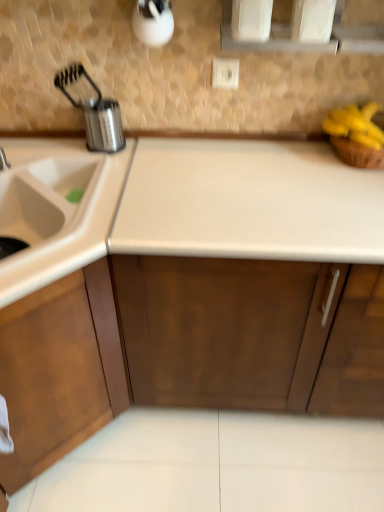
You are a GUI agent. You are given a task and a screenshot of the screen. Output one action in this format:
    pyautogui.click(x=<x>, y=<y>)
    Task: Click on the free space to the back side of brushed metal faucet at left
    This screenshot has height=512, width=384.
    Given the screenshot: What is the action you would take?
    pyautogui.click(x=32, y=145)